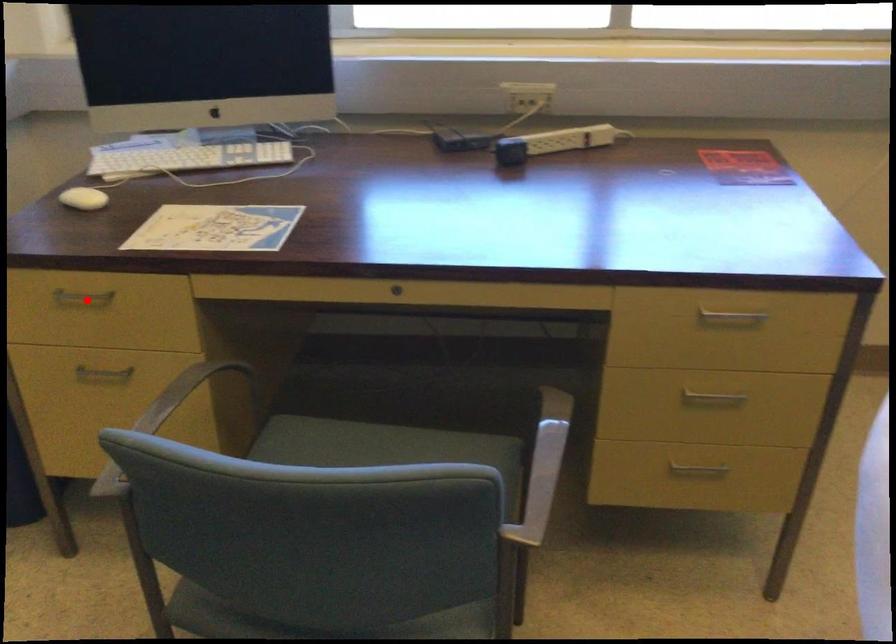
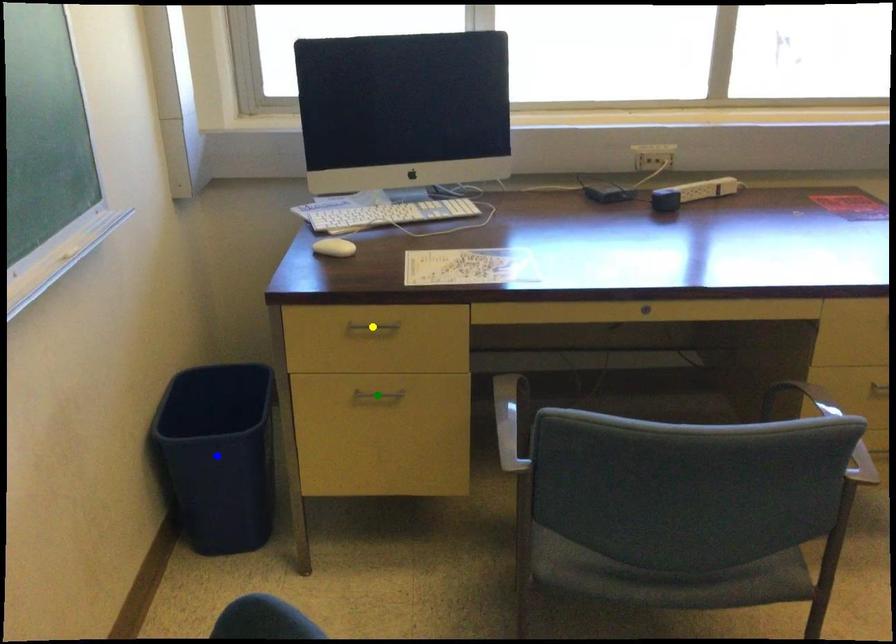
Question: I am providing you with two images of the same scene from different viewpoints. A red point is marked on the first image. You are given multiple points on the second image. Can you choose the point in image 2 that corresponds to the point in image 1?

Choices:
 (A) blue point
 (B) green point
 (C) yellow point

Answer: (C)